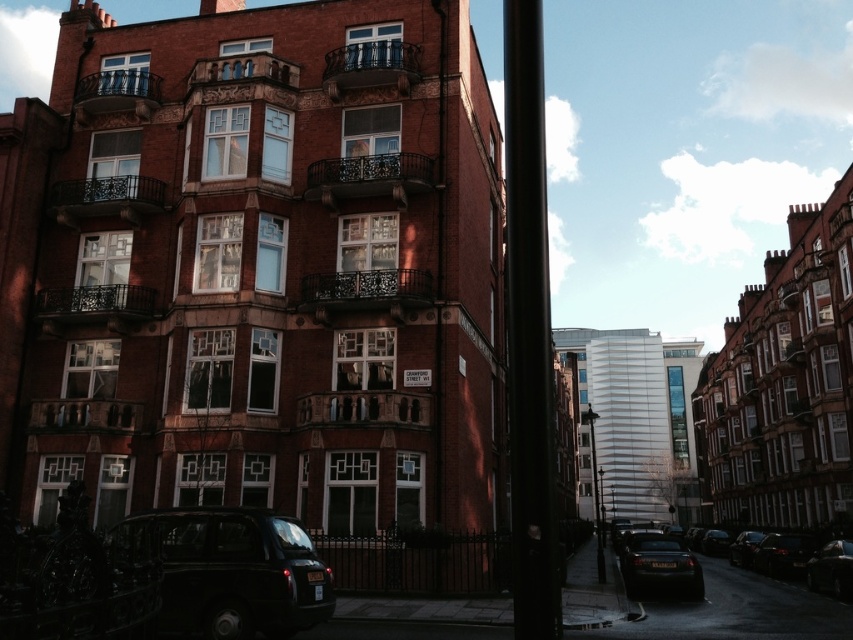
Question: Which object is closer to the camera taking this photo?

Choices:
 (A) shiny black sedan at center
 (B) shiny black car at center
 (C) black metal lamp post at center

Answer: (A)

Question: Which point is closer to the camera taking this photo?

Choices:
 (A) (602, 566)
 (B) (544, 248)
 (C) (683, 564)

Answer: (B)

Question: Is shiny black sedan at center to the left of shiny black car at lower right from the viewer's perspective?

Choices:
 (A) no
 (B) yes

Answer: (A)

Question: Can you confirm if black matte taxi at lower left is positioned to the left of black metal lamp post at center?

Choices:
 (A) yes
 (B) no

Answer: (A)

Question: Considering the relative positions of black matte pole at center and shiny black sedan at center in the image provided, where is black matte pole at center located with respect to shiny black sedan at center?

Choices:
 (A) above
 (B) below

Answer: (A)

Question: Which of the following is the farthest from the observer?

Choices:
 (A) black matte pole at center
 (B) shiny black sedan at center
 (C) black metal lamp post at center

Answer: (C)